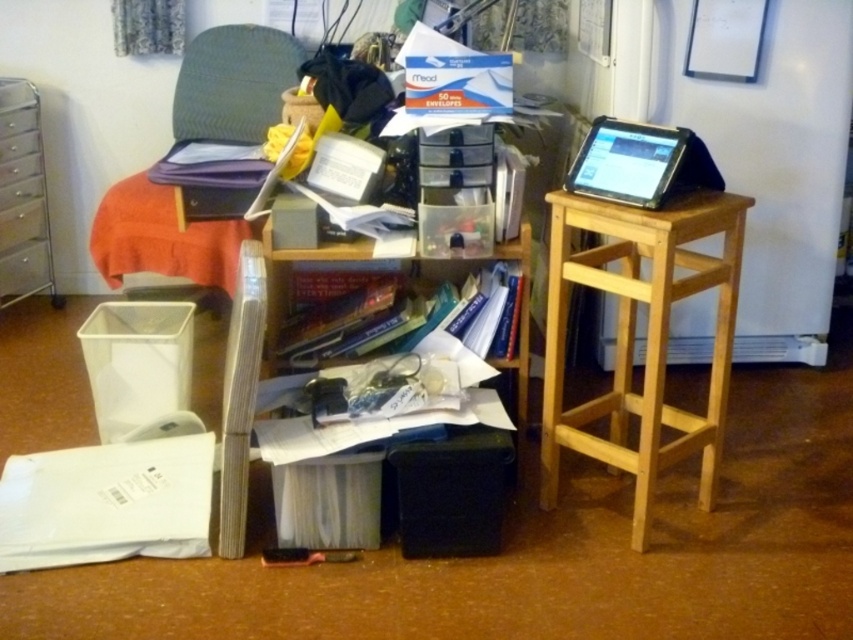
Question: Does textured fabric chair at upper left appear under metallic silver file cabinet at left?

Choices:
 (A) yes
 (B) no

Answer: (B)

Question: Which object is farther from the camera taking this photo?

Choices:
 (A) natural wood side table at right
 (B) black matte tablet at upper right
 (C) metallic silver file cabinet at left

Answer: (C)

Question: Which of the following is the closest to the observer?

Choices:
 (A) (196, 131)
 (B) (16, 227)
 (C) (643, 385)

Answer: (C)

Question: Where is natural wood side table at right located in relation to textured fabric chair at upper left in the image?

Choices:
 (A) below
 (B) above

Answer: (A)

Question: Which point is closer to the camera?

Choices:
 (A) (583, 272)
 (B) (241, 230)
 (C) (660, 188)

Answer: (C)

Question: Is natural wood side table at right below black matte tablet at upper right?

Choices:
 (A) yes
 (B) no

Answer: (A)